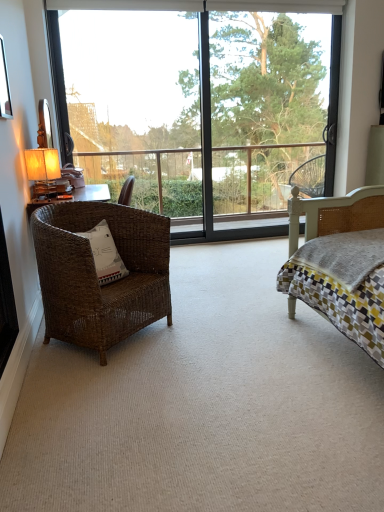
The width and height of the screenshot is (384, 512). In order to click on vacant area that is in front of brown wicker chair at left in this screenshot , I will do `click(112, 380)`.